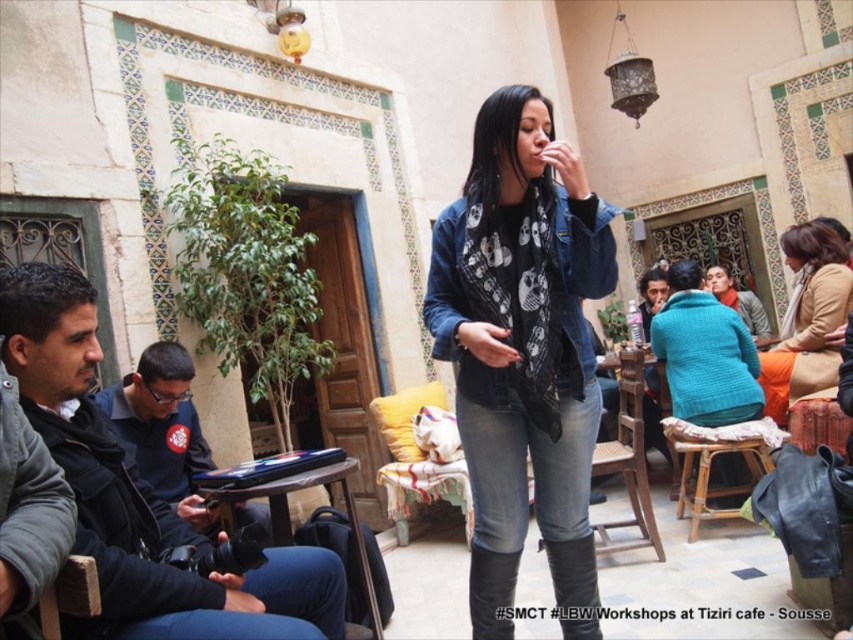
Question: Which point is farther to the camera?

Choices:
 (A) matte black scarf at center
 (B) brown woven stool at lower center
 (C) beige woolen scarf at upper right
 (D) wooden at center

Answer: (A)

Question: Does denim jacket at center lie behind wooden at center?

Choices:
 (A) yes
 (B) no

Answer: (B)

Question: Where is brown woven stool at lower center located in relation to matte black scarf at center in the image?

Choices:
 (A) left
 (B) right

Answer: (A)

Question: Considering the real-world distances, which object is closest to the black leather jacket at left?

Choices:
 (A) jeans at center
 (B) wooden at center
 (C) brown woven stool at lower center

Answer: (A)

Question: Which point is farther to the camera?

Choices:
 (A) wooden at center
 (B) black leather jacket at left
 (C) brown woven stool at lower center
 (D) denim jacket at center

Answer: (C)

Question: Does black leather jacket at left appear on the left side of dark blue fabric jacket at left?

Choices:
 (A) no
 (B) yes

Answer: (A)